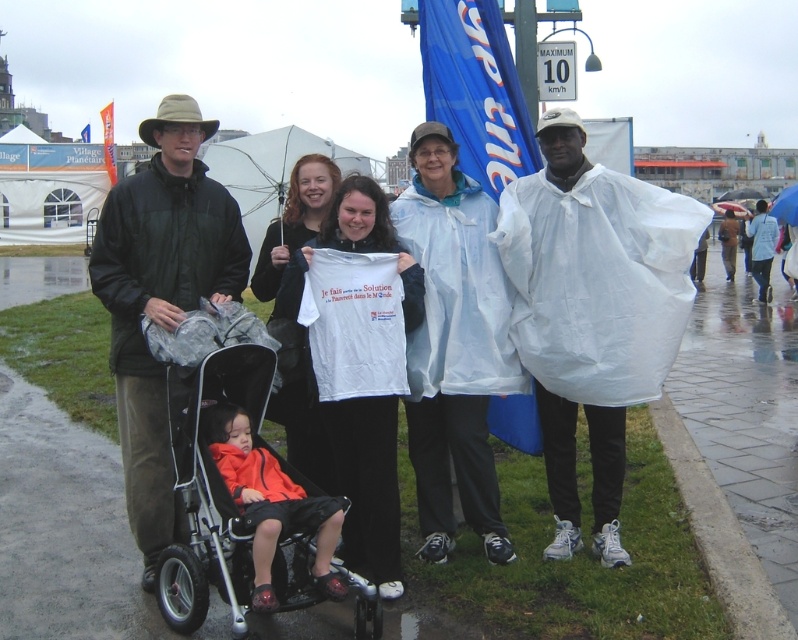
You are a photographer trying to capture a photo of the group while ensuring both the black plastic stroller at lower left and the orange fabric jacket at center are clearly visible. Given their distance apart, what is the minimum focal length you should use to include both in the frame without distortion?

The black plastic stroller at lower left and orange fabric jacket at center are 8.09 feet apart. To capture both in the frame without distortion, the photographer should use a focal length of at least 50mm, as this focal length provides a natural perspective for distances around 8 feet.